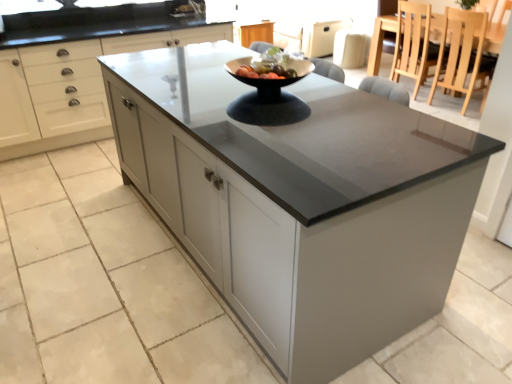
What are the coordinates of `matte white cabinets at center` in the screenshot? It's located at (70, 90).

Where is `light wood chair at upper right, the 1th chair in the front-to-back sequence`? The height and width of the screenshot is (384, 512). light wood chair at upper right, the 1th chair in the front-to-back sequence is located at coordinates (463, 55).

This screenshot has height=384, width=512. Find the location of `glossy glass bowl at center`. glossy glass bowl at center is located at coordinates (270, 65).

Identify the location of wooden dining table at upper right. (379, 41).

Is matte white cabinets at center at the right side of light wood chair at upper right, marked as the second chair in a back-to-front arrangement?

Incorrect, matte white cabinets at center is not on the right side of light wood chair at upper right, marked as the second chair in a back-to-front arrangement.

Can you confirm if matte white cabinets at center is shorter than light wood chair at upper right, the 1th chair in the front-to-back sequence?

In fact, matte white cabinets at center may be taller than light wood chair at upper right, the 1th chair in the front-to-back sequence.

Can we say matte white cabinets at center lies outside light wood chair at upper right, the 1th chair in the front-to-back sequence?

matte white cabinets at center is positioned outside light wood chair at upper right, the 1th chair in the front-to-back sequence.

From a real-world perspective, is light brown wooden chair at upper right, arranged as the second chair when viewed from the front, positioned above or below wooden dining table at upper right?

In terms of real-world spatial position, light brown wooden chair at upper right, arranged as the second chair when viewed from the front, is above wooden dining table at upper right.

Is point (426, 12) closer to camera compared to point (392, 23)?

Yes, point (426, 12) is closer to viewer.

Considering the relative positions of light brown wooden chair at upper right, the first chair viewed from the back, and wooden dining table at upper right in the image provided, is light brown wooden chair at upper right, the first chair viewed from the back, to the left or to the right of wooden dining table at upper right?

Based on their positions, light brown wooden chair at upper right, the first chair viewed from the back, is located to the left of wooden dining table at upper right.

From a real-world perspective, relative to matte white cabinets at center, is glossy glass bowl at center vertically above or below?

glossy glass bowl at center is above matte white cabinets at center.

Measure the distance from glossy glass bowl at center to matte white cabinets at center.

The distance of glossy glass bowl at center from matte white cabinets at center is 6.07 feet.

From the image's perspective, is glossy glass bowl at center on matte white cabinets at center?

No, from the image's perspective, glossy glass bowl at center is not above matte white cabinets at center.

Would you say glossy glass bowl at center is a long distance from matte white cabinets at center?

glossy glass bowl at center is positioned a significant distance from matte white cabinets at center.

Is white glossy bowl at center thinner than matte white cabinets at center?

Yes, white glossy bowl at center is thinner than matte white cabinets at center.

Is the position of white glossy bowl at center more distant than that of matte white cabinets at center?

No, it is in front of matte white cabinets at center.

Who is taller, white glossy bowl at center or matte white cabinets at center?

With more height is matte white cabinets at center.

Consider the image. From the image's perspective, is white glossy bowl at center located above or below wooden dining table at upper right?

From the image's perspective, white glossy bowl at center appears below wooden dining table at upper right.

From a real-world perspective, is white glossy bowl at center located higher than wooden dining table at upper right?

Yes, from a real-world perspective, white glossy bowl at center is above wooden dining table at upper right.

This screenshot has width=512, height=384. What are the coordinates of `table that is under the white glossy bowl at center (from a real-world perspective)` in the screenshot? It's located at (379, 41).

Does white glossy bowl at center have a smaller size compared to wooden dining table at upper right?

Indeed, white glossy bowl at center has a smaller size compared to wooden dining table at upper right.

Are matte white cabinets at center and wooden dining table at upper right making contact?

matte white cabinets at center is not next to wooden dining table at upper right, and they're not touching.

Considering the relative sizes of matte white cabinets at center and wooden dining table at upper right in the image provided, is matte white cabinets at center shorter than wooden dining table at upper right?

Incorrect, the height of matte white cabinets at center does not fall short of that of wooden dining table at upper right.

Considering the sizes of objects matte white cabinets at center and wooden dining table at upper right in the image provided, who is smaller, matte white cabinets at center or wooden dining table at upper right?

wooden dining table at upper right.

From a real-world perspective, is matte white cabinets at center positioned over wooden dining table at upper right based on gravity?

Yes.

From the image's perspective, is white glossy bowl at center on light brown wooden chair at upper right, arranged as the second chair when viewed from the front?

Actually, white glossy bowl at center appears below light brown wooden chair at upper right, arranged as the second chair when viewed from the front, in the image.

Who is bigger, white glossy bowl at center or light brown wooden chair at upper right, arranged as the second chair when viewed from the front?

With larger size is light brown wooden chair at upper right, arranged as the second chair when viewed from the front.

Could you tell me if white glossy bowl at center is facing light brown wooden chair at upper right, arranged as the second chair when viewed from the front?

No, white glossy bowl at center is not aimed at light brown wooden chair at upper right, arranged as the second chair when viewed from the front.

Consider the image. Is white glossy bowl at center wider than light brown wooden chair at upper right, arranged as the second chair when viewed from the front?

No.

This screenshot has width=512, height=384. Find the location of `cabinetry below the light wood chair at upper right, marked as the second chair in a back-to-front arrangement (from the image's perspective)`. cabinetry below the light wood chair at upper right, marked as the second chair in a back-to-front arrangement (from the image's perspective) is located at coordinates (70, 90).

Where is `chair located above the wooden dining table at upper right (from the image's perspective)`? chair located above the wooden dining table at upper right (from the image's perspective) is located at coordinates (413, 44).

Based on their spatial positions, is light brown wooden chair at upper right, arranged as the second chair when viewed from the front, or white glossy bowl at center further from light wood chair at upper right, the 1th chair in the front-to-back sequence?

The object further to light wood chair at upper right, the 1th chair in the front-to-back sequence, is white glossy bowl at center.

Based on their spatial positions, is light brown wooden chair at upper right, arranged as the second chair when viewed from the front, or light wood chair at upper right, marked as the second chair in a back-to-front arrangement, further from matte white cabinets at center?

light wood chair at upper right, marked as the second chair in a back-to-front arrangement, lies further to matte white cabinets at center than the other object.

From the image, which object appears to be farther from light wood chair at upper right, the 1th chair in the front-to-back sequence, wooden dining table at upper right or glossy glass bowl at center?

The object further to light wood chair at upper right, the 1th chair in the front-to-back sequence, is glossy glass bowl at center.

Considering their positions, is light wood chair at upper right, marked as the second chair in a back-to-front arrangement, positioned further to matte white cabinets at center than light brown wooden chair at upper right, arranged as the second chair when viewed from the front?

Among the two, light wood chair at upper right, marked as the second chair in a back-to-front arrangement, is located further to matte white cabinets at center.

Consider the image. When comparing their distances from glossy glass bowl at center, does light brown wooden chair at upper right, the first chair viewed from the back, or wooden dining table at upper right seem further?

The object further to glossy glass bowl at center is wooden dining table at upper right.

From the picture: Which object lies further to the anchor point matte white cabinets at center, wooden dining table at upper right or light wood chair at upper right, the 1th chair in the front-to-back sequence?

wooden dining table at upper right is positioned further to the anchor matte white cabinets at center.

Which object lies nearer to the anchor point light wood chair at upper right, marked as the second chair in a back-to-front arrangement, glossy glass bowl at center or white glossy bowl at center?

Among the two, white glossy bowl at center is located nearer to light wood chair at upper right, marked as the second chair in a back-to-front arrangement.

Based on the photo, estimate the real-world distances between objects in this image. Which object is further from wooden dining table at upper right, light brown wooden chair at upper right, arranged as the second chair when viewed from the front, or matte white cabinets at center?

matte white cabinets at center lies further to wooden dining table at upper right than the other object.

Where is `fruit salad located between matte white cabinets at center and light wood chair at upper right, the 1th chair in the front-to-back sequence, in the left-right direction`? This screenshot has height=384, width=512. fruit salad located between matte white cabinets at center and light wood chair at upper right, the 1th chair in the front-to-back sequence, in the left-right direction is located at coordinates (270, 65).

Where is `mixing bowl between matte white cabinets at center and light brown wooden chair at upper right, arranged as the second chair when viewed from the front`? The width and height of the screenshot is (512, 384). mixing bowl between matte white cabinets at center and light brown wooden chair at upper right, arranged as the second chair when viewed from the front is located at coordinates point(269,79).

Locate an element on the screen. chair located between white glossy bowl at center and light brown wooden chair at upper right, arranged as the second chair when viewed from the front, in the depth direction is located at coordinates (463, 55).

Locate an element on the screen. mixing bowl between matte white cabinets at center and wooden dining table at upper right from left to right is located at coordinates [x=269, y=79].